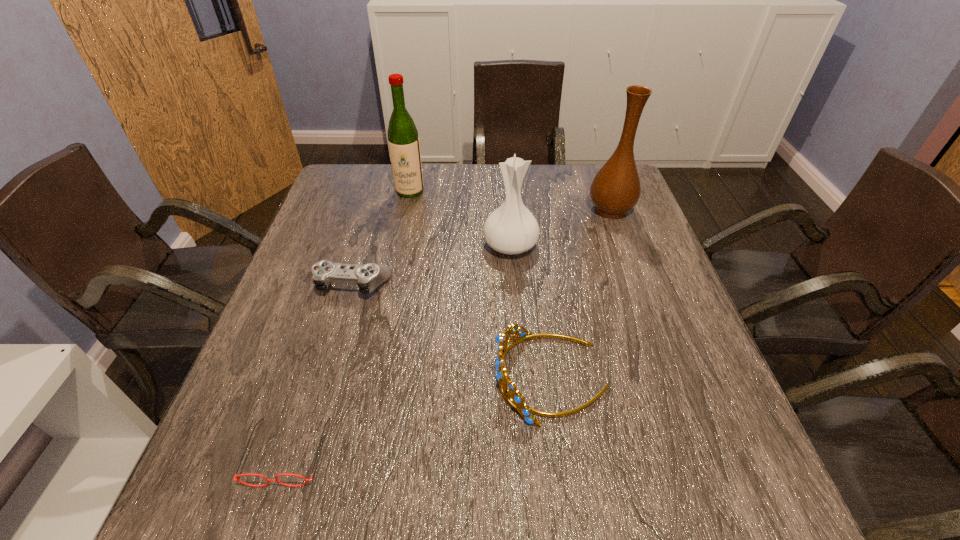
Find the location of a particular element. vacant area that lies between the third nearest object and the left vase is located at coordinates (432, 265).

The height and width of the screenshot is (540, 960). What are the coordinates of `free point between the shortest object and the third farthest object` in the screenshot? It's located at (399, 348).

Locate an element on the screen. empty space between the right vase and the second shortest object is located at coordinates (482, 247).

Locate an element on the screen. free space between the fourth tallest object and the control is located at coordinates (452, 330).

Identify the location of vacant region between the control and the liquor. (382, 238).

The width and height of the screenshot is (960, 540). I want to click on vacant space that is in between the taller vase and the third farthest object, so click(561, 227).

Identify the location of vacant space that is in between the liquor and the third farthest object. The width and height of the screenshot is (960, 540). (460, 218).

I want to click on vacant space that is in between the left vase and the rightmost object, so click(x=561, y=227).

Choose which object is the third nearest neighbor to the tiara. Please provide its 2D coordinates. Your answer should be formatted as a tuple, i.e. [(x, y)], where the tuple contains the x and y coordinates of a point satisfying the conditions above.

[(268, 480)]

At what (x,y) coordinates should I click in order to perform the action: click on object that can be found as the second closest to the control. Please return your answer as a coordinate pair (x, y). The width and height of the screenshot is (960, 540). Looking at the image, I should click on (513, 397).